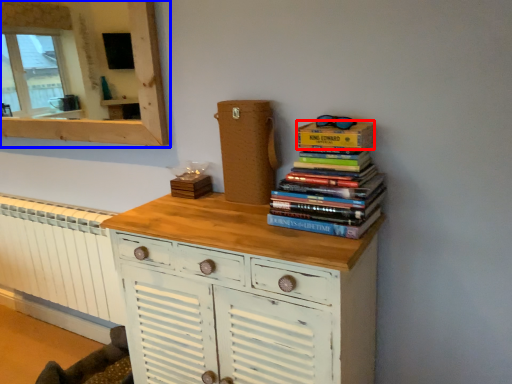
Question: Which object is further to the camera taking this photo, paperback book (highlighted by a red box) or medicine cabinet (highlighted by a blue box)?

Choices:
 (A) paperback book
 (B) medicine cabinet

Answer: (B)